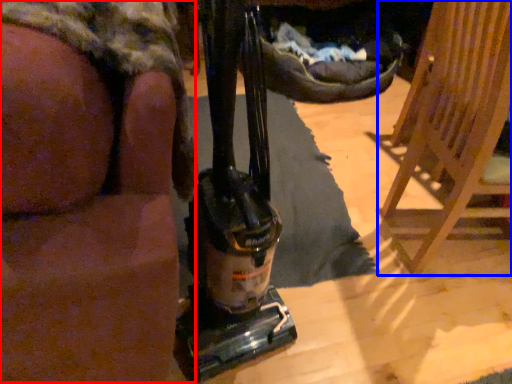
Question: Among these objects, which one is nearest to the camera, person (highlighted by a red box) or furniture (highlighted by a blue box)?

Choices:
 (A) person
 (B) furniture

Answer: (A)